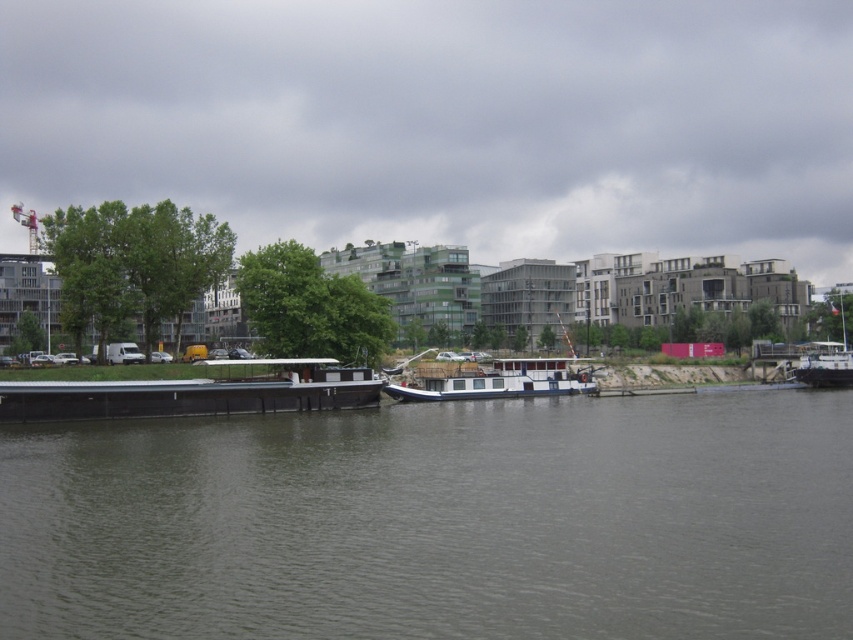
Between gray smooth water at center and black matte barge at lower left, which one has more height?

black matte barge at lower left

Does gray smooth water at center have a lesser height compared to black matte barge at lower left?

Yes, gray smooth water at center is shorter than black matte barge at lower left.

Locate an element on the screen. The width and height of the screenshot is (853, 640). gray smooth water at center is located at coordinates (437, 522).

Locate an element on the screen. Image resolution: width=853 pixels, height=640 pixels. gray smooth water at center is located at coordinates (437, 522).

Who is higher up, white matte barge at center or white wooden boat at right?

white wooden boat at right

Which is more to the left, white matte barge at center or white wooden boat at right?

Positioned to the left is white matte barge at center.

Identify the location of white matte barge at center. The width and height of the screenshot is (853, 640). (495, 380).

The image size is (853, 640). In order to click on white matte barge at center in this screenshot , I will do `click(495, 380)`.

Is black matte barge at lower left shorter than white wooden boat at right?

Yes, black matte barge at lower left is shorter than white wooden boat at right.

Between black matte barge at lower left and white wooden boat at right, which one is positioned higher?

Positioned higher is white wooden boat at right.

Does point (148, 406) lie in front of point (802, 380)?

Yes, it is.

Where is `black matte barge at lower left`? Image resolution: width=853 pixels, height=640 pixels. black matte barge at lower left is located at coordinates (196, 392).